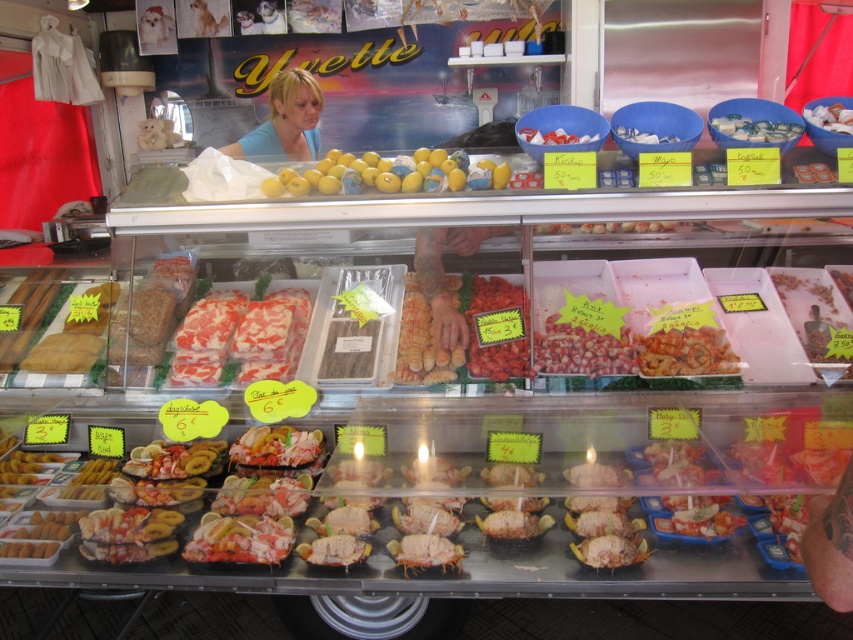
Does blue matte head at upper center lie in front of white crumbly ice at upper center?

No, blue matte head at upper center is further to the viewer.

At what (x,y) coordinates should I click in order to perform the action: click on blue matte head at upper center. Please return your answer as a coordinate pair (x, y). The image size is (853, 640). Looking at the image, I should click on (283, 122).

Does point (310, 84) come in front of point (561, 131)?

No.

Where is `blue matte head at upper center`? blue matte head at upper center is located at coordinates (283, 122).

Can you confirm if yellow matte olives at center is positioned below white glossy ice cream at center?

Yes.

You are a GUI agent. You are given a task and a screenshot of the screen. Output one action in this format:
    pyautogui.click(x=<x>, y=<y>)
    Task: Click on the yellow matte olives at center
    The width and height of the screenshot is (853, 640).
    Given the screenshot: What is the action you would take?
    pyautogui.click(x=390, y=173)

Where is `yellow matte olives at center`? Image resolution: width=853 pixels, height=640 pixels. yellow matte olives at center is located at coordinates (390, 173).

Who is more forward, (282, 136) or (259, 545)?

Point (259, 545) is in front.

Does blue matte head at upper center have a larger size compared to shiny lobster at center?

Yes.

Which is in front, point (260, 147) or point (209, 524)?

Point (209, 524) is in front.

Locate an element on the screen. blue matte head at upper center is located at coordinates tap(283, 122).